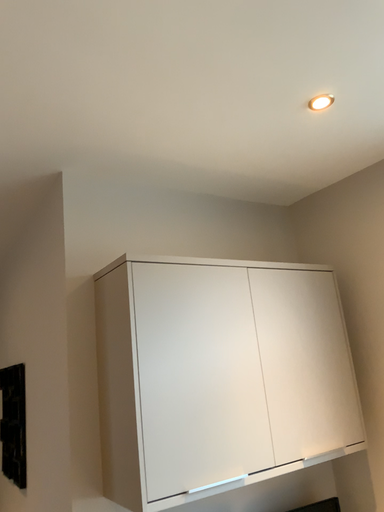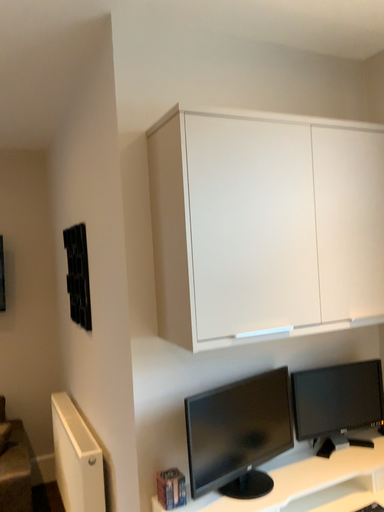
Question: Which way did the camera rotate in the video?

Choices:
 (A) rotated right
 (B) rotated left

Answer: (B)